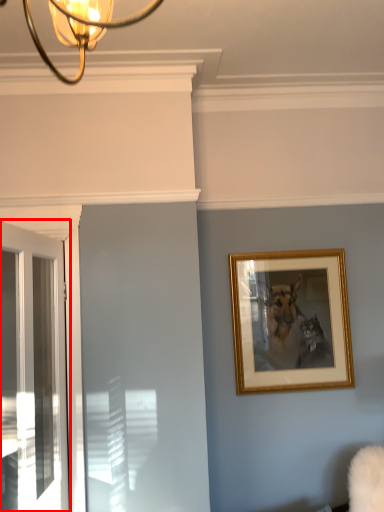
Question: From the image's perspective, where is door (annotated by the red box) located in relation to picture frame in the image?

Choices:
 (A) below
 (B) above

Answer: (A)